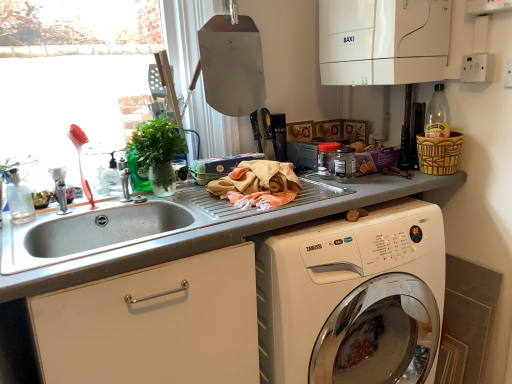
At what (x,y) coordinates should I click in order to perform the action: click on free spot below green leafy plant at upper left (from a real-world perspective). Please return your answer as a coordinate pair (x, y). Looking at the image, I should click on (164, 197).